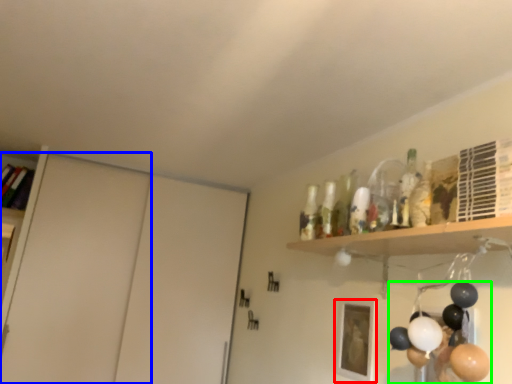
Question: Based on their relative distances, which object is farther from picture frame (highlighted by a red box)? Choose from door (highlighted by a blue box) and balloon (highlighted by a green box).

Choices:
 (A) door
 (B) balloon

Answer: (A)